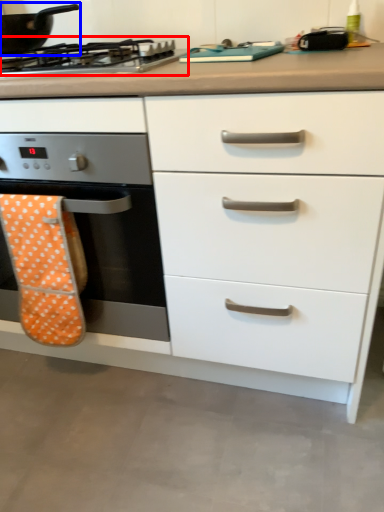
Question: Which object appears closest to the camera in this image, gas stove (highlighted by a red box) or kitchen appliance (highlighted by a blue box)?

Choices:
 (A) gas stove
 (B) kitchen appliance

Answer: (A)